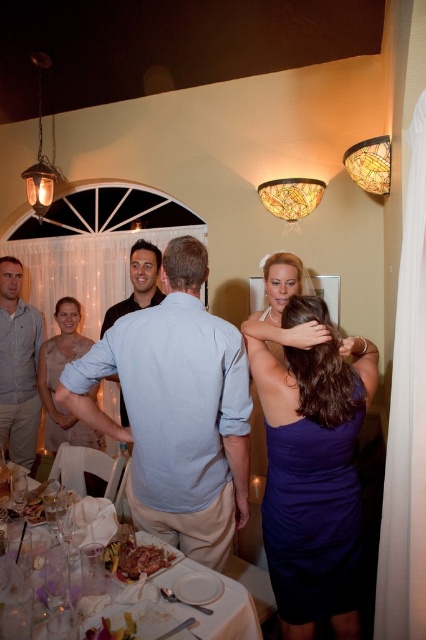
Question: Among these points, which one is farthest from the camera?

Choices:
 (A) (270, 278)
 (B) (51, 372)
 (C) (32, 449)

Answer: (C)

Question: Among these points, which one is farthest from the camera?

Choices:
 (A) (131, 333)
 (B) (273, 376)
 (C) (135, 476)

Answer: (C)

Question: Is purple satin dress at upper right smaller than striped cotton shirt at left?

Choices:
 (A) yes
 (B) no

Answer: (A)

Question: Does striped cotton shirt at left have a larger size compared to matte black shirt at center?

Choices:
 (A) no
 (B) yes

Answer: (B)

Question: Among these points, which one is nearest to the camera?

Choices:
 (A) (275, 586)
 (B) (115, 304)
 (C) (103, 378)

Answer: (A)

Question: Does purple satin dress at upper right have a larger size compared to matte black shirt at center?

Choices:
 (A) no
 (B) yes

Answer: (B)